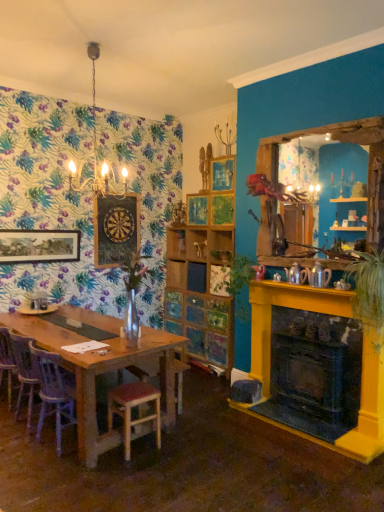
At what (x,y) coordinates should I click in order to perform the action: click on vacant area situated below pine wood stool at lower left (from a real-world perspective). Please return your answer as a coordinate pair (x, y). This screenshot has width=384, height=512. Looking at the image, I should click on (135, 450).